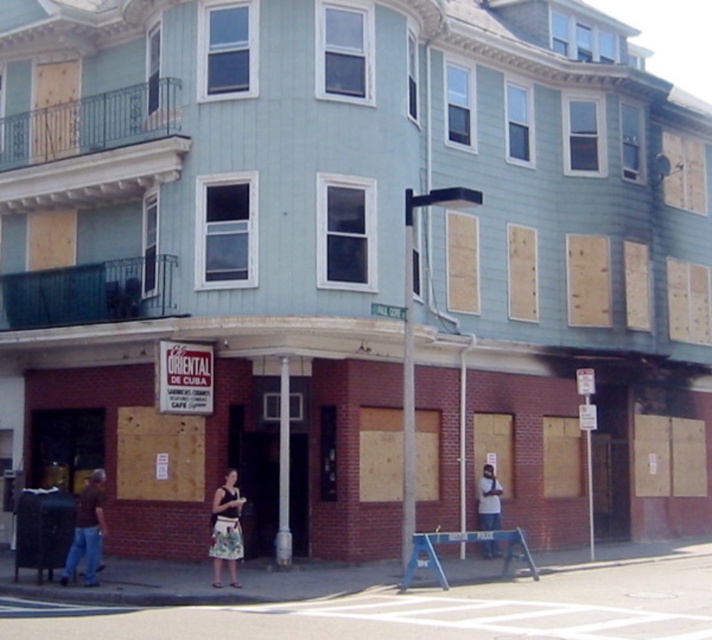
Can you confirm if brown denim jeans at lower left is positioned above floral skirt at center?

Actually, brown denim jeans at lower left is below floral skirt at center.

Can you confirm if brown denim jeans at lower left is shorter than floral skirt at center?

Yes.

The width and height of the screenshot is (712, 640). What are the coordinates of `brown denim jeans at lower left` in the screenshot? It's located at (88, 531).

Who is lower down, brown denim jeans at lower left or light blue denim jeans at lower center?

light blue denim jeans at lower center is below.

Between point (68, 572) and point (497, 516), which one is positioned in front?

Point (68, 572)

You are a GUI agent. You are given a task and a screenshot of the screen. Output one action in this format:
    pyautogui.click(x=<x>, y=<y>)
    Task: Click on the brown denim jeans at lower left
    
    Given the screenshot: What is the action you would take?
    pyautogui.click(x=88, y=531)

Can you confirm if floral skirt at center is bigger than light blue denim jeans at lower center?

Yes, floral skirt at center is bigger than light blue denim jeans at lower center.

Between point (234, 538) and point (491, 484), which one is positioned in front?

Point (234, 538) is in front.

Where is `floral skirt at center`? floral skirt at center is located at coordinates click(226, 529).